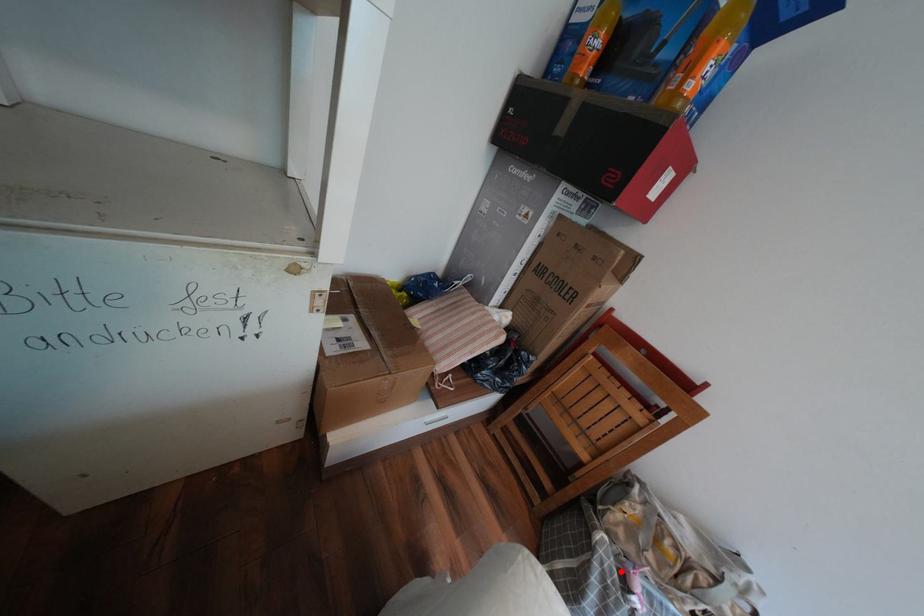
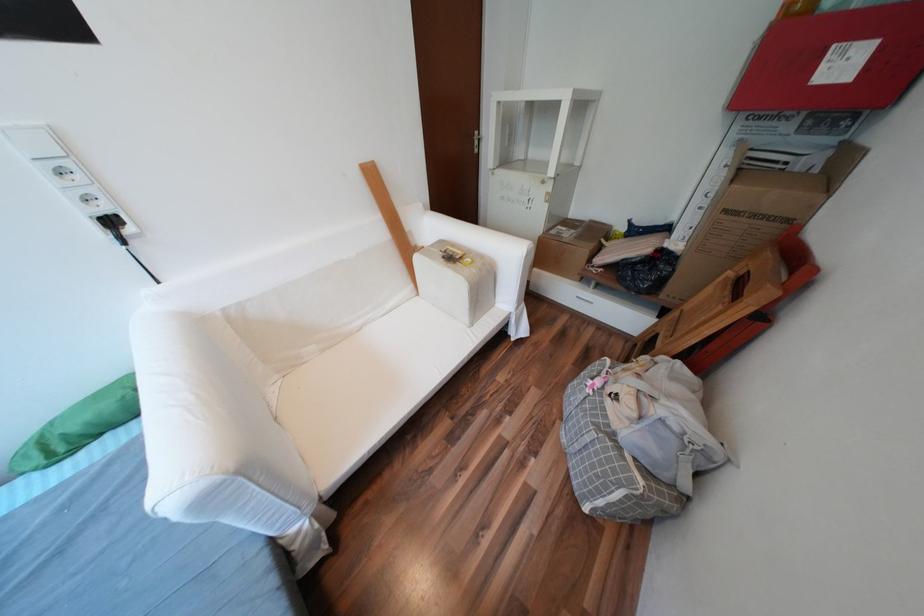
Where in the second image is the point corresponding to the highlighted location from the first image?

(602, 371)